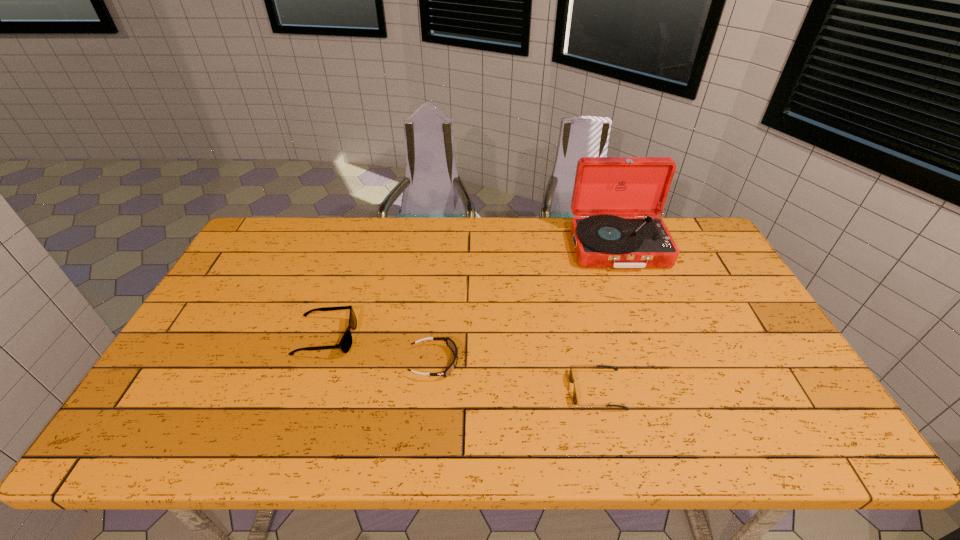
Where is `vacant space at the far right corner of the desktop`? This screenshot has height=540, width=960. vacant space at the far right corner of the desktop is located at coordinates (698, 237).

The width and height of the screenshot is (960, 540). I want to click on empty space between the tallest object and the third object from right to left, so click(x=526, y=305).

The height and width of the screenshot is (540, 960). I want to click on free space that is in between the goggles and the farther sunglasses, so click(x=380, y=350).

At what (x,y) coordinates should I click in order to perform the action: click on empty location between the goggles and the leftmost object. Please return your answer as a coordinate pair (x, y). The width and height of the screenshot is (960, 540). Looking at the image, I should click on (380, 350).

The image size is (960, 540). I want to click on empty space between the left sunglasses and the goggles, so click(380, 350).

Image resolution: width=960 pixels, height=540 pixels. What are the coordinates of `unoccupied position between the tallest object and the goggles` in the screenshot? It's located at (526, 305).

The image size is (960, 540). Identify the location of free space between the nearer sunglasses and the farthest object. (608, 319).

The height and width of the screenshot is (540, 960). I want to click on free point between the tallest object and the goggles, so click(x=526, y=305).

You are a GUI agent. You are given a task and a screenshot of the screen. Output one action in this format:
    pyautogui.click(x=<x>, y=<y>)
    Task: Click on the empty space that is in between the leftmost object and the third object from right to left
    This screenshot has height=540, width=960.
    Given the screenshot: What is the action you would take?
    pyautogui.click(x=380, y=350)

Find the location of a particular element. blank region between the shorter sunglasses and the phonograph_record is located at coordinates (608, 319).